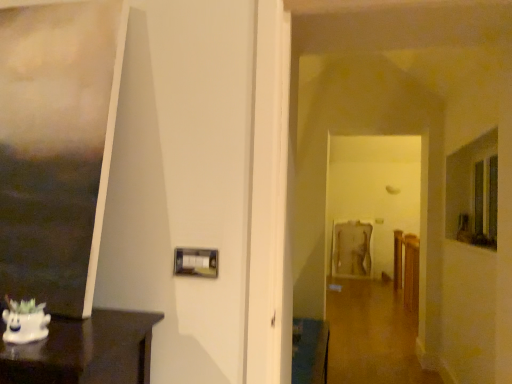
This screenshot has height=384, width=512. What do you see at coordinates (196, 262) in the screenshot? I see `white plastic light switch at center` at bounding box center [196, 262].

This screenshot has width=512, height=384. I want to click on white plastic light switch at center, so click(x=196, y=262).

The height and width of the screenshot is (384, 512). Identify the location of white plastic light switch at center. (196, 262).